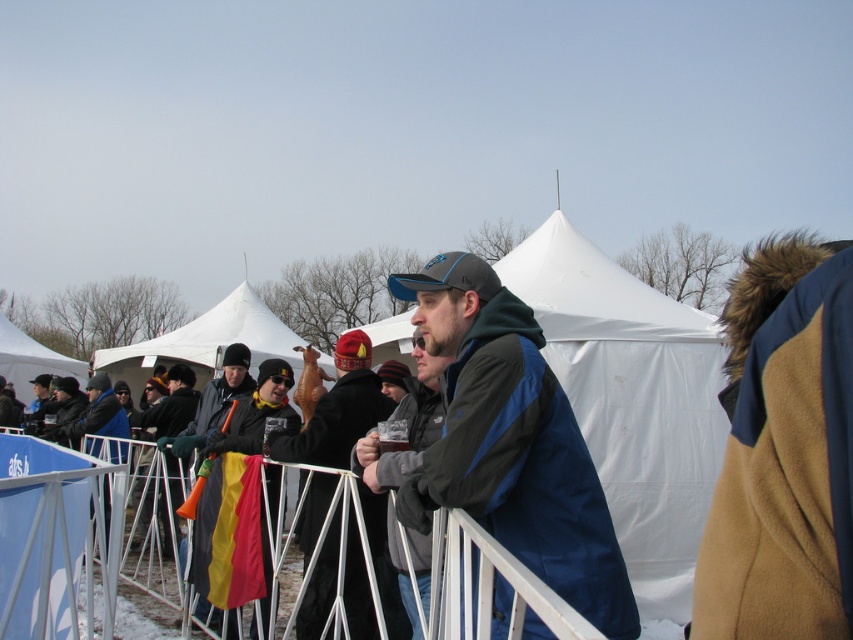
You are a photographer trying to capture a photo of the white fabric canopy at center without including the dark blue fleece jacket at center in the frame. Based on their positions, is this possible?

The dark blue fleece jacket at center is to the right of the white fabric canopy at center, so if you position yourself to the left side of the white fabric canopy at center, you can avoid including the dark blue fleece jacket at center in your photo.